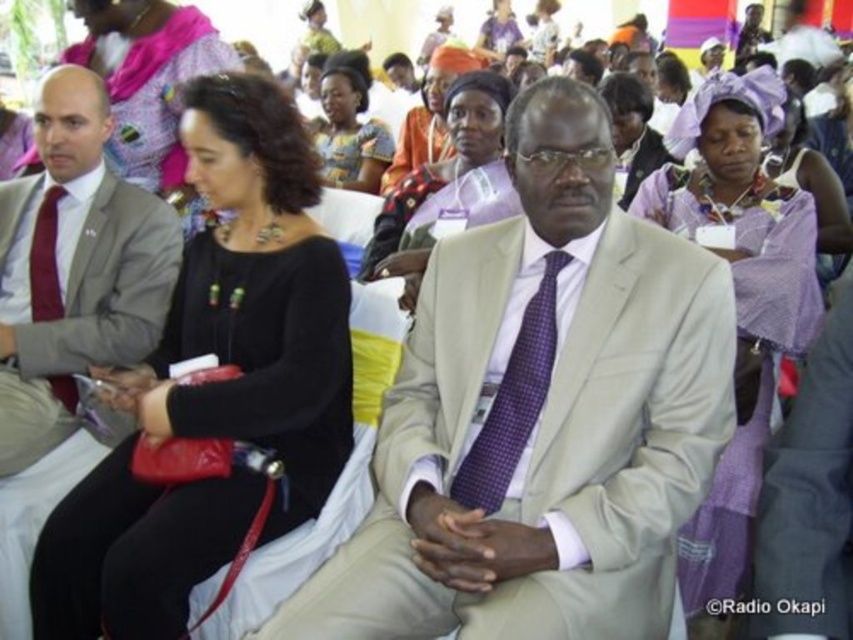
Question: Which point is farther to the camera?

Choices:
 (A) matte red tie at left
 (B) purple checkered tie at center
 (C) purple woven fabric headscarf at upper center
 (D) beige fabric suit at center

Answer: (A)

Question: Which of these objects is positioned farthest from the beige fabric suit at center?

Choices:
 (A) matte gray suit at left
 (B) purple woven fabric headscarf at upper center
 (C) purple checkered tie at center

Answer: (A)

Question: Does purple checkered tie at center have a lesser width compared to matte purple dress at center?

Choices:
 (A) no
 (B) yes

Answer: (B)

Question: Does beige fabric suit at center appear under purple checkered tie at center?

Choices:
 (A) yes
 (B) no

Answer: (B)

Question: From the image, what is the correct spatial relationship of purple woven fabric headscarf at upper center in relation to matte red tie at left?

Choices:
 (A) right
 (B) left

Answer: (A)

Question: Which of these objects is positioned closest to the matte gray suit at left?

Choices:
 (A) black matte dress at center
 (B) purple checkered tie at center
 (C) beige fabric suit at center

Answer: (A)